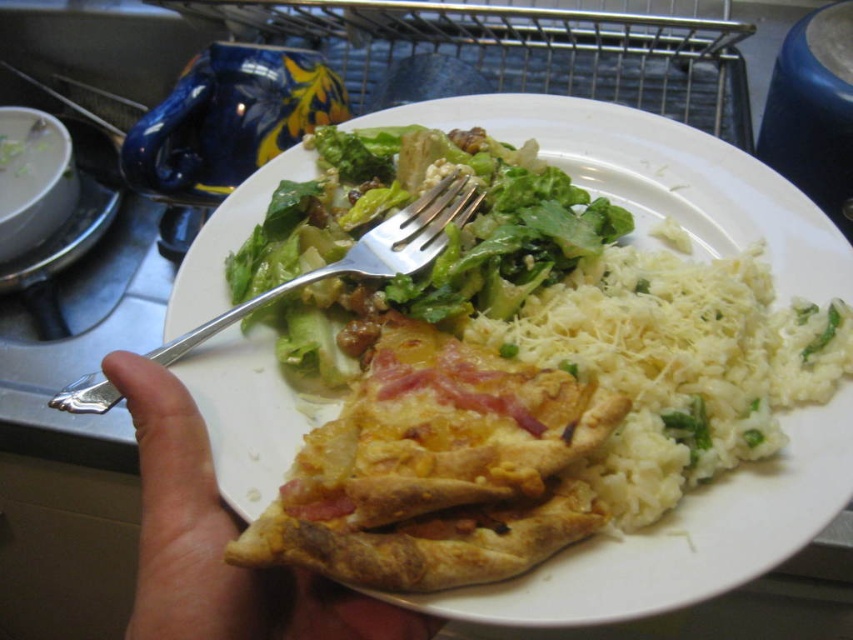
Does brown textured hand at lower left have a lesser width compared to silver metallic fork at upper center?

Indeed, brown textured hand at lower left has a lesser width compared to silver metallic fork at upper center.

Does point (369, 616) lie behind point (410, 243)?

That is False.

Where is `brown textured hand at lower left`? The height and width of the screenshot is (640, 853). brown textured hand at lower left is located at coordinates pyautogui.click(x=219, y=541).

Measure the distance between point (x=788, y=208) and camera.

A distance of 28.03 inches exists between point (x=788, y=208) and camera.

Can you confirm if white matte plate at center is wider than white fluffy rice at center-right?

Yes.

Is point (851, 460) positioned after point (572, 276)?

No, (851, 460) is in front of (572, 276).

Locate an element on the screen. The width and height of the screenshot is (853, 640). white matte plate at center is located at coordinates (662, 179).

Is the position of golden brown crispy omelet at center less distant than that of silver metallic fork at upper center?

Yes.

Locate an element on the screen. The height and width of the screenshot is (640, 853). golden brown crispy omelet at center is located at coordinates (440, 468).